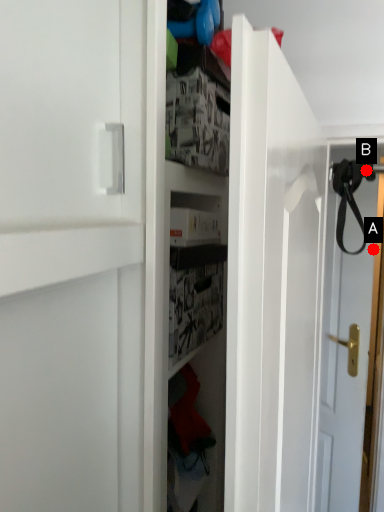
Question: Two points are circled on the image, labeled by A and B beside each circle. Which point is closer to the camera?

Choices:
 (A) A is closer
 (B) B is closer

Answer: (B)